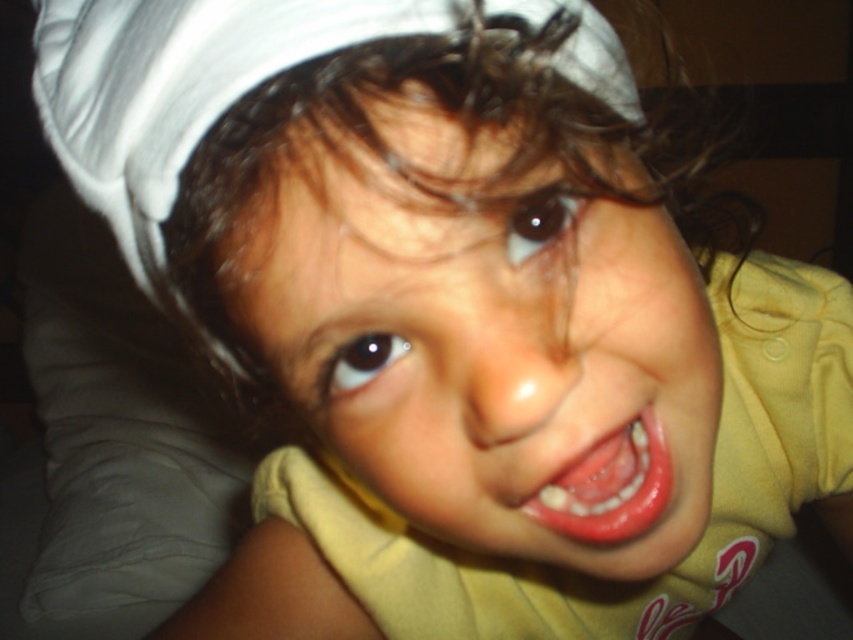
Question: Is smooth skin face at center thinner than smooth pink lips at center?

Choices:
 (A) no
 (B) yes

Answer: (A)

Question: Which of the following is the farthest from the observer?

Choices:
 (A) smooth skin face at center
 (B) smooth pink lips at center

Answer: (B)

Question: Does smooth skin face at center appear under smooth pink lips at center?

Choices:
 (A) yes
 (B) no

Answer: (B)

Question: Does smooth skin face at center appear on the left side of smooth pink lips at center?

Choices:
 (A) yes
 (B) no

Answer: (A)